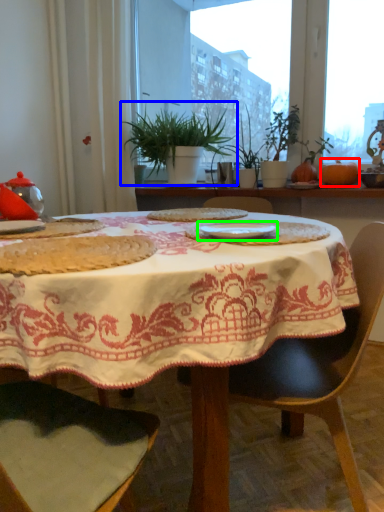
Question: Estimate the real-world distances between objects in this image. Which object is farther from pumpkin (highlighted by a red box), houseplant (highlighted by a blue box) or tableware (highlighted by a green box)?

Choices:
 (A) houseplant
 (B) tableware

Answer: (B)